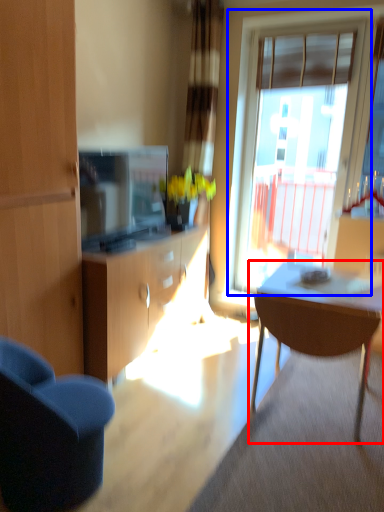
Question: Which of the following is the farthest to the observer, kitchen & dining room table (highlighted by a red box) or window (highlighted by a blue box)?

Choices:
 (A) kitchen & dining room table
 (B) window

Answer: (B)